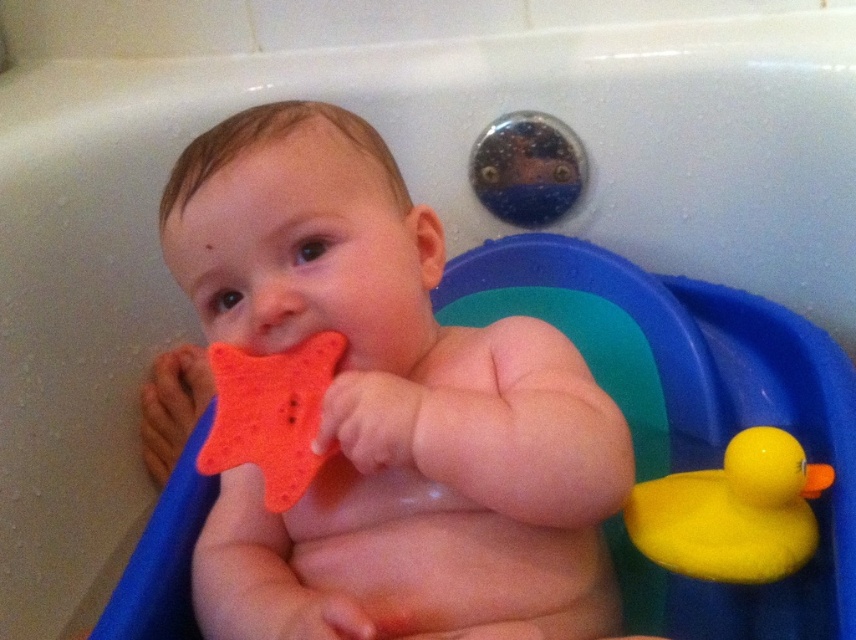
Question: Which of the following is the closest to the observer?

Choices:
 (A) (311, 456)
 (B) (266, 196)
 (C) (750, 509)

Answer: (A)

Question: Considering the real-world distances, which object is closest to the orange sponge star at center?

Choices:
 (A) orange sponge at center
 (B) rubber duck at right

Answer: (A)

Question: Can you confirm if orange sponge at center is positioned below orange sponge star at center?

Choices:
 (A) no
 (B) yes

Answer: (B)

Question: Which point appears farthest from the camera in this image?

Choices:
 (A) (278, 451)
 (B) (444, 636)

Answer: (A)

Question: From the image, what is the correct spatial relationship of orange sponge at center in relation to rubber duck at right?

Choices:
 (A) left
 (B) right

Answer: (A)

Question: Is orange sponge at center further to the viewer compared to rubber duck at right?

Choices:
 (A) yes
 (B) no

Answer: (B)